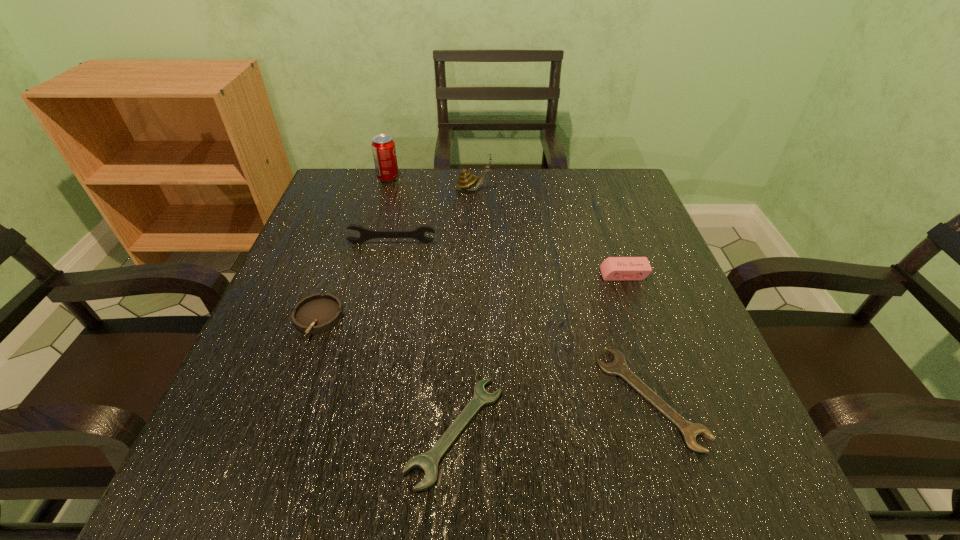
Locate an element on the screen. soda is located at coordinates (383, 147).

Locate an element on the screen. The height and width of the screenshot is (540, 960). the sixth shortest object is located at coordinates (466, 181).

Find the location of a particular element. This screenshot has height=540, width=960. the farthest wrench is located at coordinates (365, 234).

This screenshot has width=960, height=540. Identify the location of the fifth shortest object. (365, 234).

Identify the location of eraser. (613, 268).

I want to click on the fourth shortest object, so click(x=613, y=268).

This screenshot has width=960, height=540. In order to click on the third shortest object in this screenshot , I will do `click(317, 313)`.

You are a GUI agent. You are given a task and a screenshot of the screen. Output one action in this format:
    pyautogui.click(x=<x>, y=<y>)
    Task: Click on the third nearest object
    
    Given the screenshot: What is the action you would take?
    pyautogui.click(x=317, y=313)

Identify the location of the rightmost wrench. (618, 367).

The image size is (960, 540). What are the coordinates of `vacant space located on the right of the tallest object` in the screenshot? It's located at (536, 178).